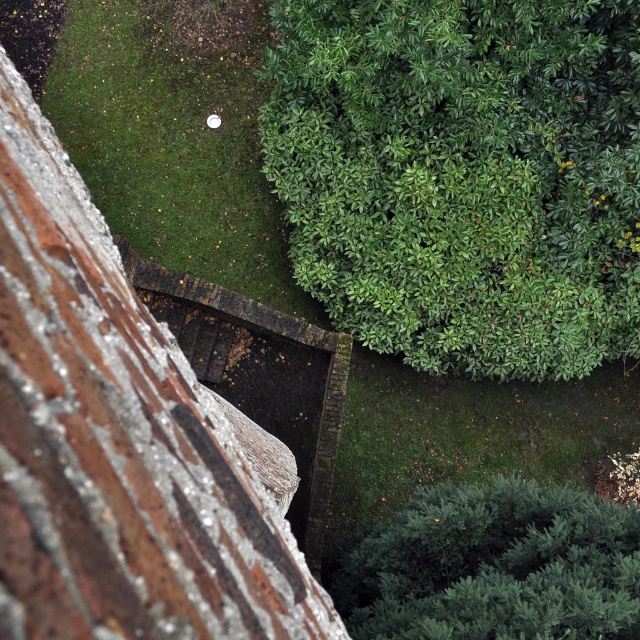
You are standing at the center of the brick wall in the foreground and want to place a small decorative statue exactly at the upper right corner of the scene. Given that the scene can be represented as a coordinate system with the bottom left corner as the origin, where would you place the statue to align it with the green leafy bush at upper right?

The green leafy bush at upper right is located at coordinates approximately 0.277 on the x axis and 0.725 on the y axis. To align the statue with it, place it at the same coordinates.

You are a gardener who wants to trim the green leafy bush at upper right and the smooth brick wall at center. Which object requires more time to maintain based on their size?

The green leafy bush at upper right requires more time to maintain because it is larger in size than the smooth brick wall at center.

You are standing at the center of the walkway below the brick wall and want to see the view behind the green leafy bush at upper right and the green leafy hedge at lower right. Which one will block your view more?

The green leafy bush at upper right is much taller than the green leafy hedge at lower right, so it will block your view more.